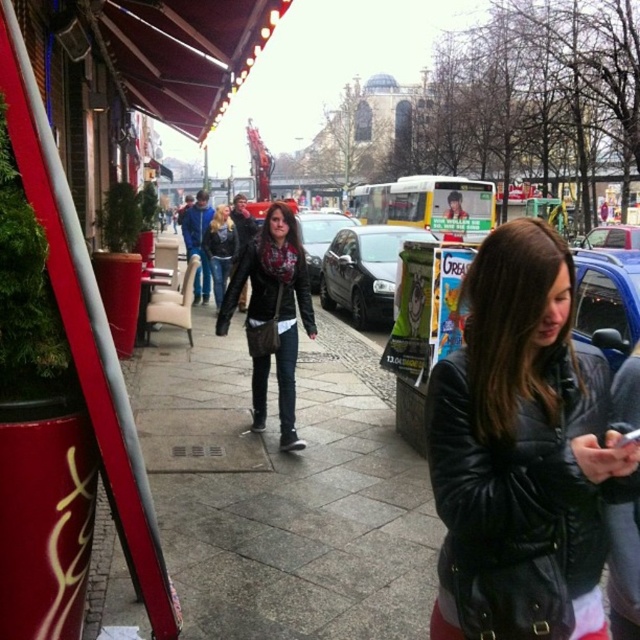
Question: Can you confirm if black leather jacket at center is smaller than blue metallic car at center-right?

Choices:
 (A) yes
 (B) no

Answer: (A)

Question: Does blue metallic car at center-right come behind metallic silver car at center?

Choices:
 (A) yes
 (B) no

Answer: (B)

Question: Which point is closer to the camera?

Choices:
 (A) (321, 237)
 (B) (616, 262)
 (C) (340, 637)
 (D) (268, 259)

Answer: (C)

Question: Based on their relative distances, which object is nearer to the matte black jacket at center?

Choices:
 (A) matte black scarf at center
 (B) smooth concrete sidewalk at center
 (C) black leather jacket at center

Answer: (A)

Question: Which point is farther to the camera?

Choices:
 (A) (604, 310)
 (B) (340, 337)

Answer: (B)

Question: Can you confirm if smooth concrete sidewalk at center is positioned to the right of shiny black car at center?

Choices:
 (A) yes
 (B) no

Answer: (B)